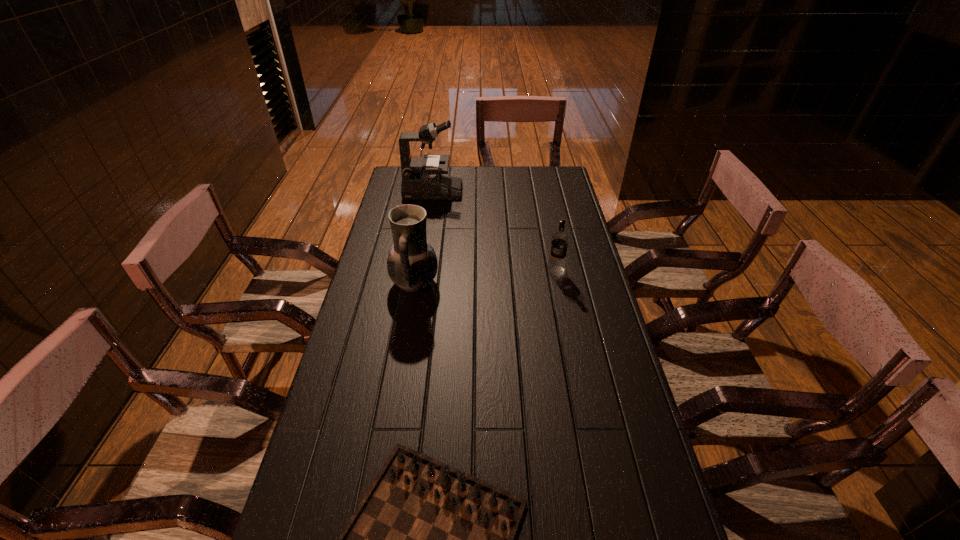
The image size is (960, 540). In order to click on object positioned at the right edge in this screenshot , I will do `click(559, 240)`.

This screenshot has width=960, height=540. I want to click on object that is at the far left corner, so click(421, 177).

At what (x,y) coordinates should I click in order to perform the action: click on blank space at the far edge of the desktop. Please return your answer as a coordinate pair (x, y). Image resolution: width=960 pixels, height=540 pixels. Looking at the image, I should click on (501, 188).

Where is `vacant space at the left edge of the desktop`? This screenshot has width=960, height=540. vacant space at the left edge of the desktop is located at coordinates (363, 442).

At what (x,y) coordinates should I click in order to perform the action: click on vacant space at the right edge of the desktop. Please return your answer as a coordinate pair (x, y). Image resolution: width=960 pixels, height=540 pixels. Looking at the image, I should click on (596, 340).

In the image, there is a desktop. At what (x,y) coordinates should I click in order to perform the action: click on free space at the far right corner. Please return your answer as a coordinate pair (x, y). The image size is (960, 540). Looking at the image, I should click on (537, 186).

What are the coordinates of `vacant area that lies between the pitcher and the rightmost object` in the screenshot? It's located at (485, 277).

Locate an element on the screen. Image resolution: width=960 pixels, height=540 pixels. vacant area that lies between the rightmost object and the pitcher is located at coordinates (485, 277).

Find the location of a particular element. Image resolution: width=960 pixels, height=540 pixels. free spot between the vodka and the microscope is located at coordinates (494, 231).

The width and height of the screenshot is (960, 540). I want to click on the second closest object to the pitcher, so click(421, 177).